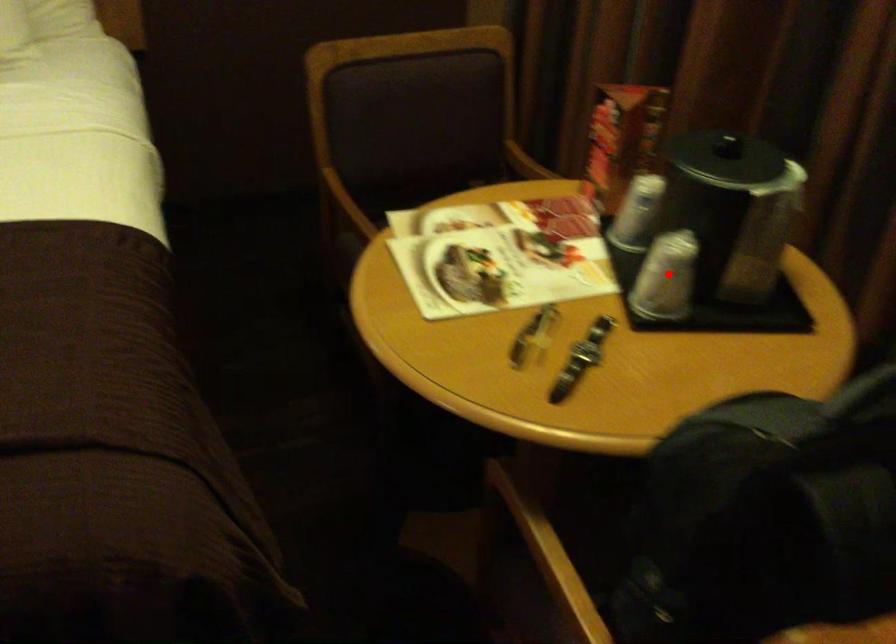
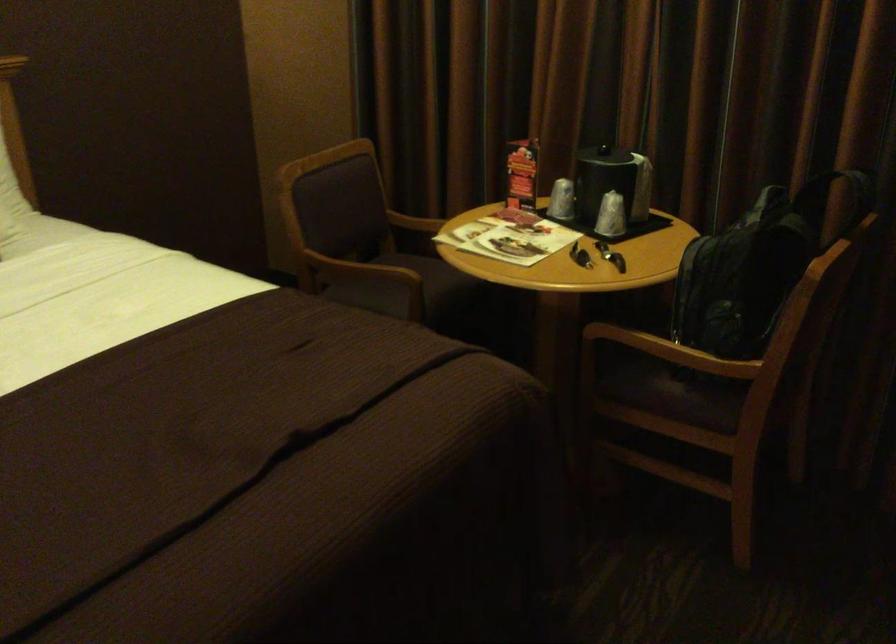
Question: I am providing you with two images of the same scene from different viewpoints. Given a red point in image1, look at the same physical point in image2. Is it:

Choices:
 (A) Closer to the viewpoint
 (B) Farther from the viewpoint

Answer: (B)